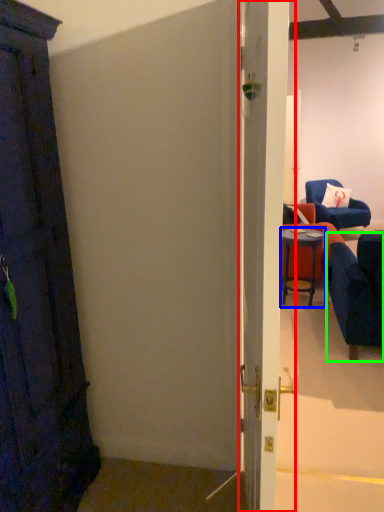
Question: Estimate the real-world distances between objects in this image. Which object is closer to door (highlighted by a red box), table (highlighted by a blue box) or chair (highlighted by a green box)?

Choices:
 (A) table
 (B) chair

Answer: (B)